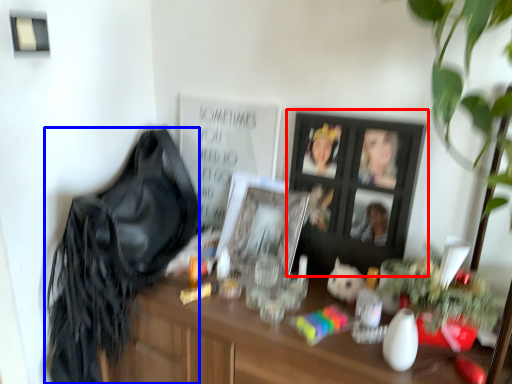
Question: Which of the following is the farthest to the observer, picture frame (highlighted by a red box) or shoulder bag (highlighted by a blue box)?

Choices:
 (A) picture frame
 (B) shoulder bag

Answer: (A)